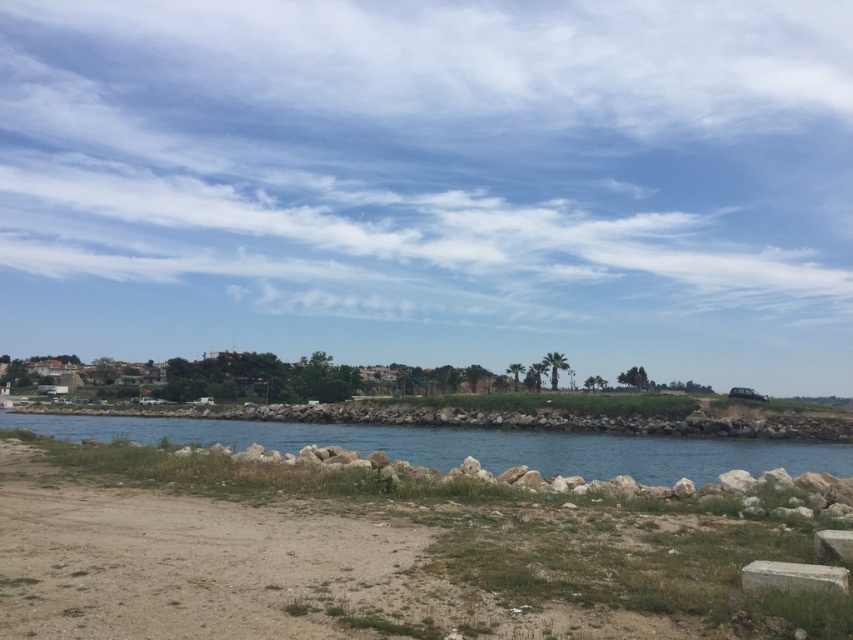
Does point (326, 545) come farther from viewer compared to point (753, 561)?

That is True.

Which is behind, point (451, 576) or point (798, 564)?

Positioned behind is point (451, 576).

Does point (730, 504) come closer to viewer compared to point (744, 564)?

That is False.

At what (x,y) coordinates should I click in order to perform the action: click on dull brown dirt at lower left. Please return your answer as a coordinate pair (x, y). Looking at the image, I should click on (368, 557).

Does dull brown dirt at lower left appear on the left side of blue stone water at center?

In fact, dull brown dirt at lower left is to the right of blue stone water at center.

Does dull brown dirt at lower left have a smaller size compared to blue stone water at center?

Yes.

Locate an element on the screen. This screenshot has height=640, width=853. dull brown dirt at lower left is located at coordinates (368, 557).

Who is shorter, blue stone water at center or white marble stone at lower right?

white marble stone at lower right is shorter.

Which is more to the left, blue stone water at center or white marble stone at lower right?

blue stone water at center

Is point (780, 445) closer to viewer compared to point (817, 586)?

No.

At what (x,y) coordinates should I click in order to perform the action: click on blue stone water at center. Please return your answer as a coordinate pair (x, y). The width and height of the screenshot is (853, 640). Looking at the image, I should click on (471, 445).